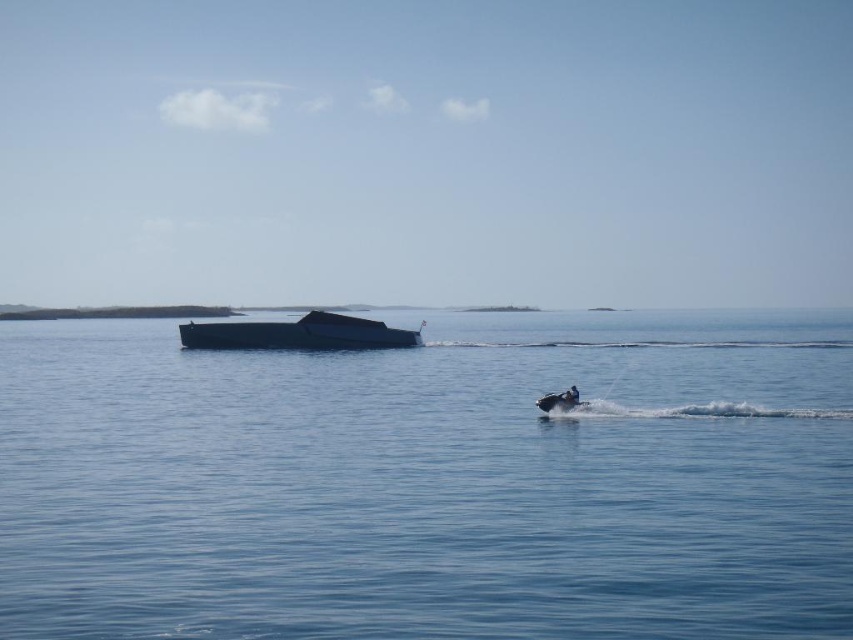
Which is in front, point (428, 580) or point (550, 397)?

Point (428, 580) is in front.

The width and height of the screenshot is (853, 640). In order to click on blue water at center in this screenshot , I will do `click(431, 481)`.

Measure the distance between point (778, 490) and camera.

Point (778, 490) and camera are 14.83 meters apart from each other.

Does blue water at center lie in front of shiny black boat at center?

Yes, it is.

Between point (325, 502) and point (401, 332), which one is positioned behind?

The point (401, 332) is more distant.

Locate an element on the screen. This screenshot has width=853, height=640. blue water at center is located at coordinates click(431, 481).

Does shiny black boat at center appear under dark blue fabric person at lower right?

No, shiny black boat at center is not below dark blue fabric person at lower right.

Who is taller, shiny black boat at center or dark blue fabric person at lower right?

Standing taller between the two is shiny black boat at center.

Which is behind, point (229, 332) or point (572, 388)?

Positioned behind is point (229, 332).

What are the coordinates of `shiny black boat at center` in the screenshot? It's located at (299, 333).